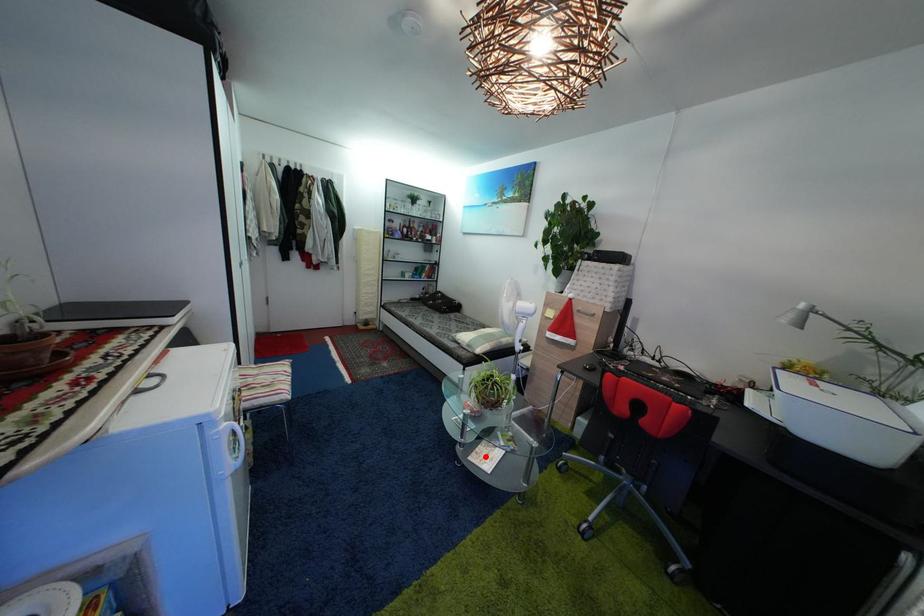
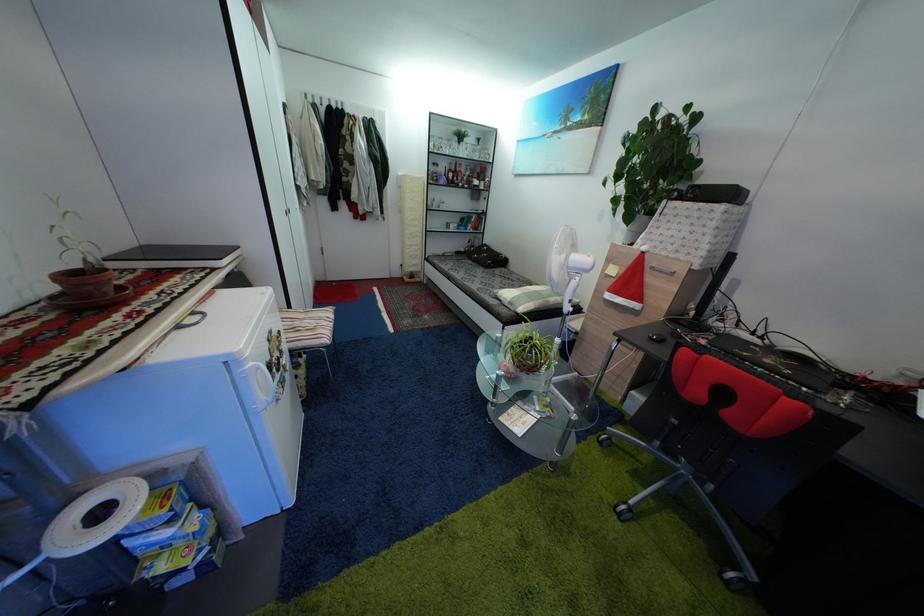
Question: I am providing you with two images of the same scene from different viewpoints. Given a red point in image1, look at the same physical point in image2. Is it:

Choices:
 (A) Closer to the viewpoint
 (B) Farther from the viewpoint

Answer: (A)